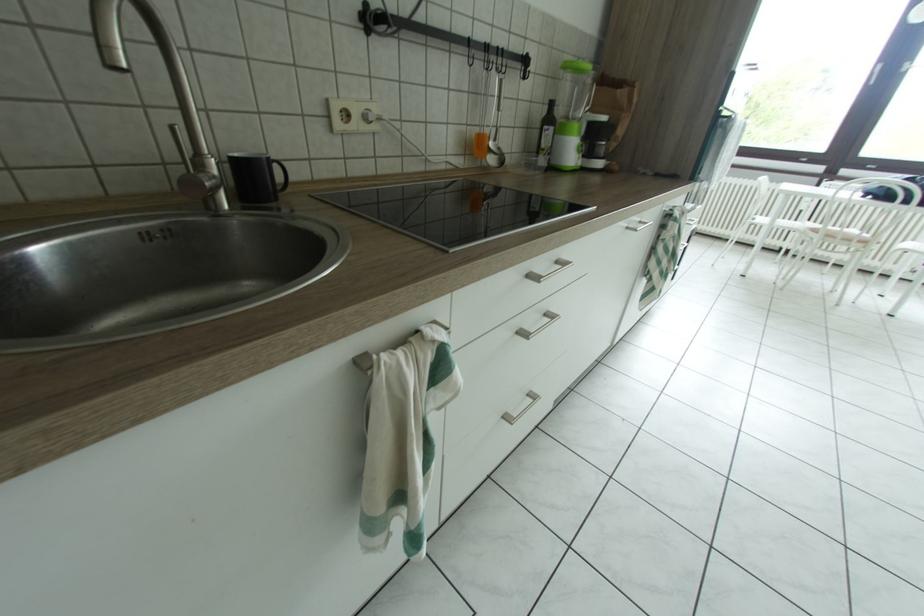
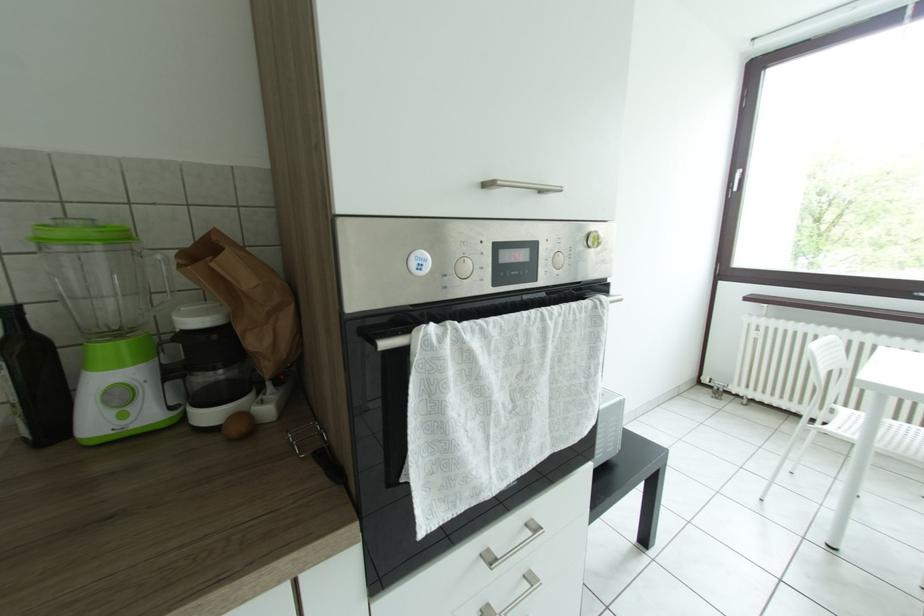
The images are taken continuously from a first-person perspective. In which direction are you moving?

The cameraman walked toward right, forward.